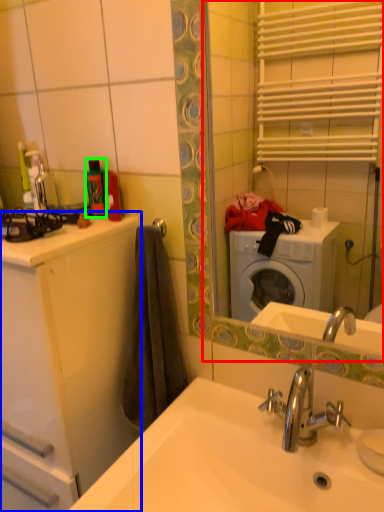
Question: Which object is positioned closest to mirror (highlighted by a red box)? Select from bathroom cabinet (highlighted by a blue box) and toiletry (highlighted by a green box).

Choices:
 (A) bathroom cabinet
 (B) toiletry

Answer: (A)